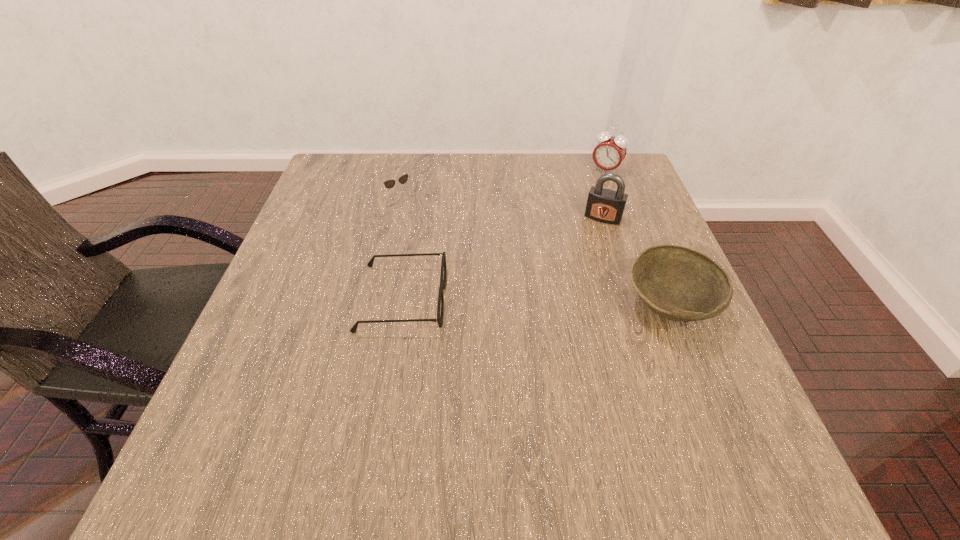
The height and width of the screenshot is (540, 960). I want to click on the shortest object, so click(x=439, y=320).

Locate an element on the screen. Image resolution: width=960 pixels, height=540 pixels. bowl is located at coordinates (677, 283).

Where is `sunglasses`? The height and width of the screenshot is (540, 960). sunglasses is located at coordinates (389, 184).

Find the location of a particular element. Image resolution: width=960 pixels, height=540 pixels. the farthest object is located at coordinates (609, 153).

In order to click on padlock in this screenshot , I will do 604,205.

Locate an element on the screen. The height and width of the screenshot is (540, 960). vacant region located on the front-facing side of the spectacles is located at coordinates (599, 298).

At what (x,y) coordinates should I click in order to perform the action: click on vacant point located 0.080m on the front of the bowl. Please return your answer as a coordinate pair (x, y). Image resolution: width=960 pixels, height=540 pixels. Looking at the image, I should click on (698, 382).

You are a GUI agent. You are given a task and a screenshot of the screen. Output one action in this format:
    pyautogui.click(x=<x>, y=<y>)
    Task: Click on the vacant space positioned in front of the lenses of the sunglasses
    The width and height of the screenshot is (960, 540).
    Given the screenshot: What is the action you would take?
    pyautogui.click(x=439, y=235)

Where is `vacant space located in front of the lenses of the sunglasses`? The height and width of the screenshot is (540, 960). vacant space located in front of the lenses of the sunglasses is located at coordinates pyautogui.click(x=457, y=253).

Locate an element on the screen. Image resolution: width=960 pixels, height=540 pixels. free space located in front of the lenses of the sunglasses is located at coordinates (476, 273).